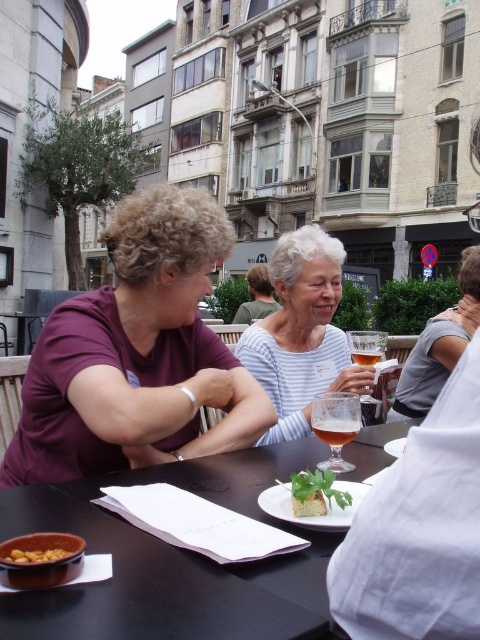
Question: From the image, what is the correct spatial relationship of purple matte shirt at left in relation to translucent glass beer at center?

Choices:
 (A) above
 (B) below

Answer: (A)

Question: Among these objects, which one is farthest from the camera?

Choices:
 (A) purple matte shirt at left
 (B) matte brown bowl at lower left
 (C) golden crispy chips at lower left

Answer: (A)

Question: Does white striped shirt at center appear on the right side of golden crispy chips at lower left?

Choices:
 (A) no
 (B) yes

Answer: (B)

Question: Which object is closer to the camera taking this photo?

Choices:
 (A) green leafy garnish at center
 (B) matte brown bowl at lower left

Answer: (B)

Question: Among these points, which one is nearest to the camera?

Choices:
 (A) (19, 588)
 (B) (324, 323)
 (C) (380, 433)

Answer: (A)

Question: Is white striped shirt at center bigger than green leafy garnish at center?

Choices:
 (A) no
 (B) yes

Answer: (B)